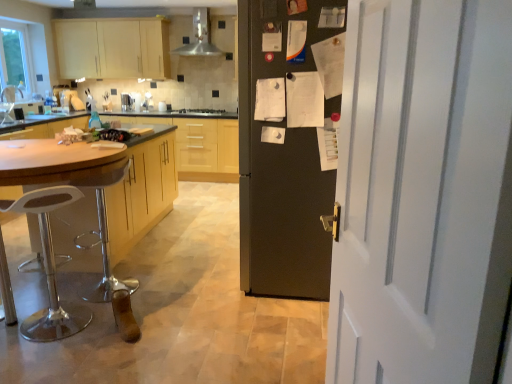
This screenshot has width=512, height=384. Identify the location of vacant region to the right of wooden cabinet at center, which is the 1th cabinetry from front to back. (188, 233).